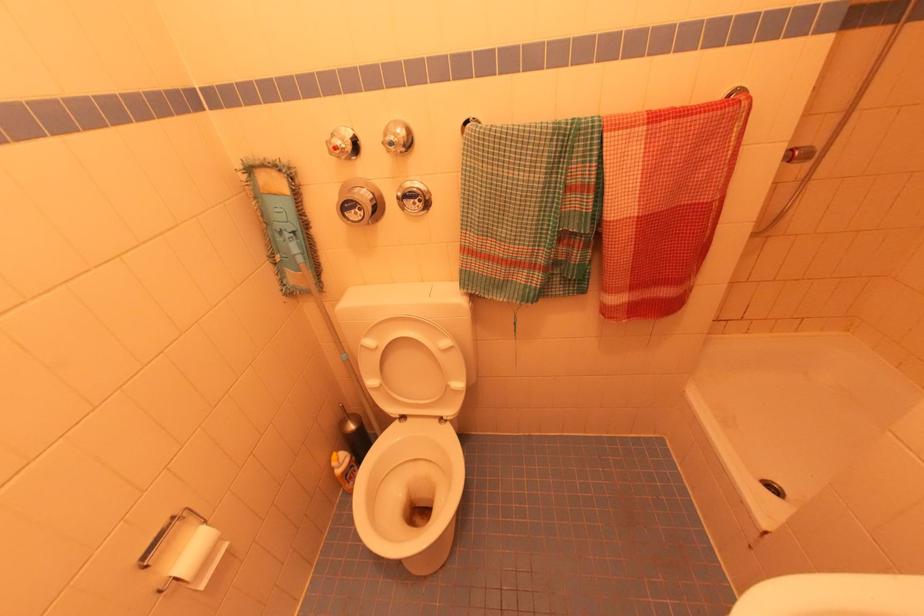
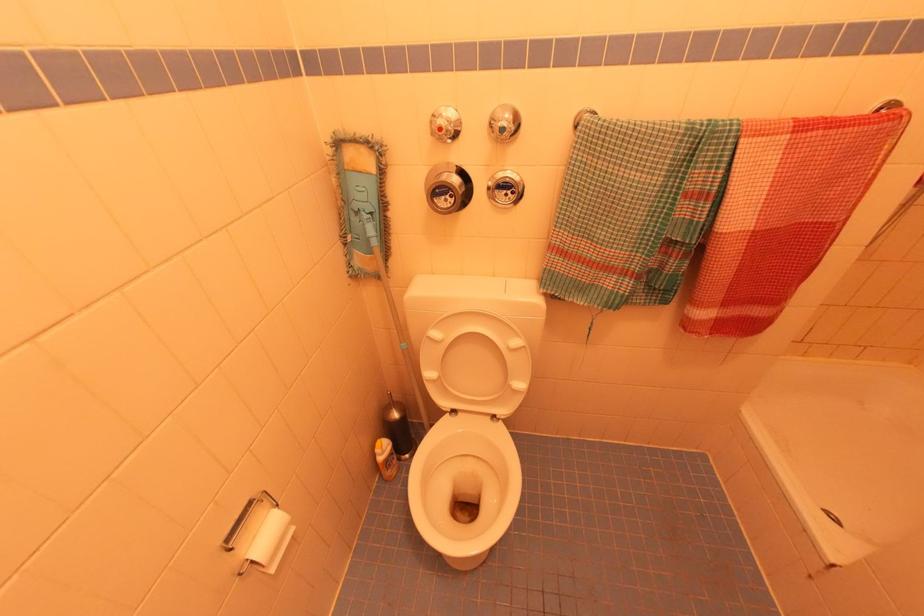
The point at (343, 461) is marked in the first image. Where is the corresponding point in the second image?

(385, 448)